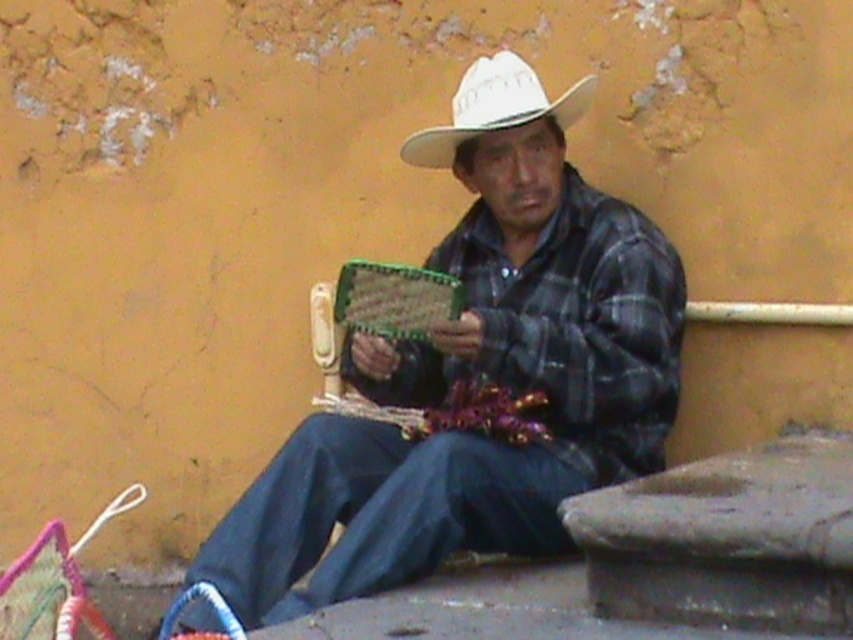
Question: Which point is closer to the camera?

Choices:
 (A) (428, 477)
 (B) (469, 99)

Answer: (A)

Question: From the image, what is the correct spatial relationship of plaid fabric shirt at center in relation to white matte cowboy hat at center?

Choices:
 (A) above
 (B) below

Answer: (B)

Question: Which point appears farthest from the camera in this image?

Choices:
 (A) (540, 216)
 (B) (503, 104)

Answer: (A)

Question: Is plaid fabric shirt at center below white matte cowboy hat at center?

Choices:
 (A) yes
 (B) no

Answer: (A)

Question: Can you confirm if plaid fabric shirt at center is positioned below white matte cowboy hat at center?

Choices:
 (A) no
 (B) yes

Answer: (B)

Question: Which point is closer to the camera taking this photo?

Choices:
 (A) (575, 92)
 (B) (531, 541)

Answer: (B)